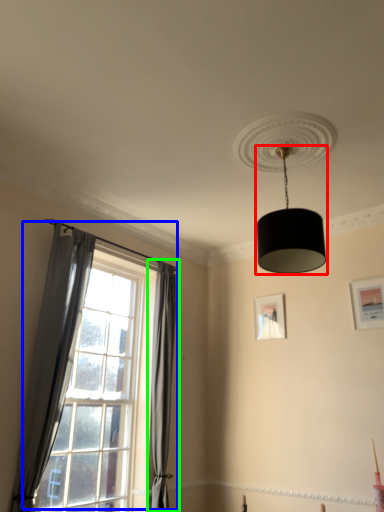
Question: Considering the real-world distances, which object is farthest from lamp (highlighted by a red box)? window (highlighted by a blue box) or curtain (highlighted by a green box)?

Choices:
 (A) window
 (B) curtain

Answer: (A)